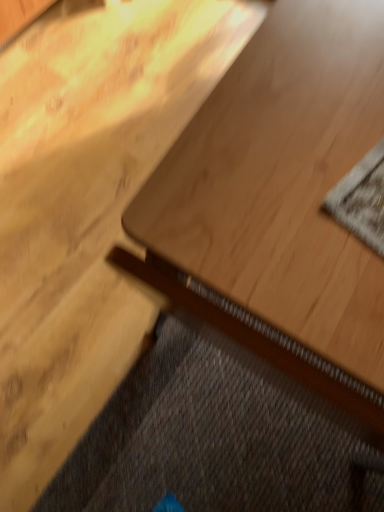
Question: Is light wood table at center smaller than textured gray mat at upper right?

Choices:
 (A) no
 (B) yes

Answer: (A)

Question: Is light wood table at center to the right of textured gray mat at upper right from the viewer's perspective?

Choices:
 (A) yes
 (B) no

Answer: (B)

Question: Could you tell me if light wood table at center is facing textured gray mat at upper right?

Choices:
 (A) no
 (B) yes

Answer: (A)

Question: Is the position of light wood table at center less distant than that of textured gray mat at upper right?

Choices:
 (A) no
 (B) yes

Answer: (B)

Question: Does light wood table at center have a greater height compared to textured gray mat at upper right?

Choices:
 (A) no
 (B) yes

Answer: (B)

Question: In terms of width, does textured gray mat at upper right look wider or thinner when compared to dark gray textured doormat at lower left?

Choices:
 (A) thin
 (B) wide

Answer: (A)

Question: Would you say textured gray mat at upper right is inside or outside dark gray textured doormat at lower left?

Choices:
 (A) inside
 (B) outside

Answer: (B)

Question: In terms of size, does textured gray mat at upper right appear bigger or smaller than dark gray textured doormat at lower left?

Choices:
 (A) big
 (B) small

Answer: (B)

Question: Is textured gray mat at upper right in front of or behind dark gray textured doormat at lower left in the image?

Choices:
 (A) front
 (B) behind

Answer: (A)

Question: In the image, is light wood table at center on the left side or the right side of dark gray textured doormat at lower left?

Choices:
 (A) right
 (B) left

Answer: (A)

Question: Is point (195, 119) positioned closer to the camera than point (195, 462)?

Choices:
 (A) farther
 (B) closer

Answer: (B)

Question: From their relative heights in the image, would you say light wood table at center is taller or shorter than dark gray textured doormat at lower left?

Choices:
 (A) short
 (B) tall

Answer: (B)

Question: In the image, is light wood table at center positioned in front of or behind dark gray textured doormat at lower left?

Choices:
 (A) behind
 (B) front

Answer: (B)

Question: Is textured gray mat at upper right bigger or smaller than light wood table at center?

Choices:
 (A) big
 (B) small

Answer: (B)

Question: Which is correct: textured gray mat at upper right is inside light wood table at center, or outside of it?

Choices:
 (A) inside
 (B) outside

Answer: (A)